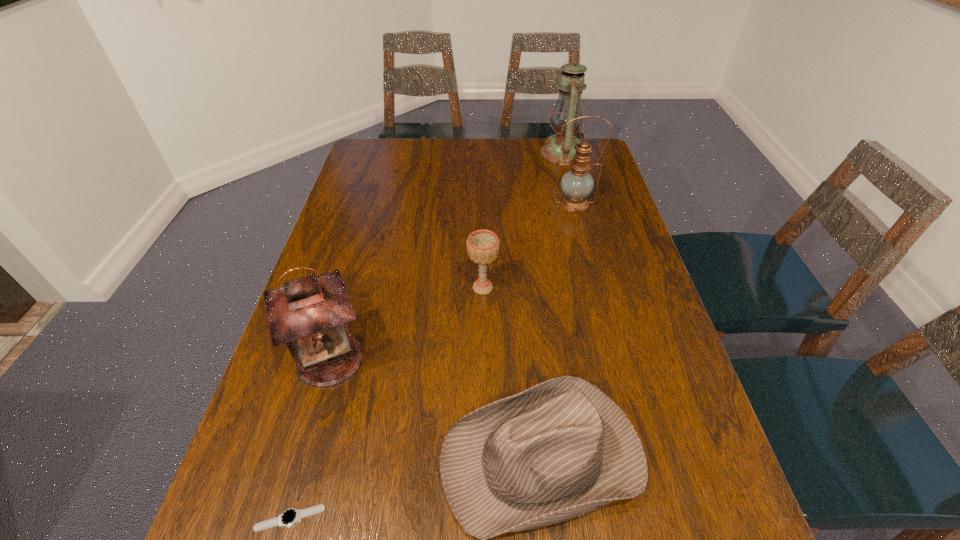
Where is `vacant space at the far right corner of the desktop`? The image size is (960, 540). vacant space at the far right corner of the desktop is located at coordinates (596, 170).

The width and height of the screenshot is (960, 540). I want to click on free space that is in between the watch and the second farthest oil lamp, so click(432, 361).

Locate an element on the screen. empty location between the watch and the nearest oil lamp is located at coordinates (310, 438).

Locate an element on the screen. empty location between the second farthest oil lamp and the third shortest object is located at coordinates (528, 245).

The image size is (960, 540). I want to click on blank region between the third shortest object and the nearest oil lamp, so click(x=406, y=323).

The image size is (960, 540). In order to click on free point between the fifth nearest object and the shortest object in this screenshot , I will do `click(432, 361)`.

Identify which object is the fourth closest to the nearest oil lamp. Please provide its 2D coordinates. Your answer should be formatted as a tuple, i.e. [(x, y)], where the tuple contains the x and y coordinates of a point satisfying the conditions above.

[(576, 184)]

This screenshot has width=960, height=540. In order to click on object that stands as the closest to the leftmost oil lamp in this screenshot , I will do `click(561, 449)`.

Select which oil lamp appears as the second closest to the watch. Please provide its 2D coordinates. Your answer should be formatted as a tuple, i.e. [(x, y)], where the tuple contains the x and y coordinates of a point satisfying the conditions above.

[(576, 184)]

The width and height of the screenshot is (960, 540). Find the location of `oil lamp that is the second closest to the chalice`. oil lamp that is the second closest to the chalice is located at coordinates (576, 184).